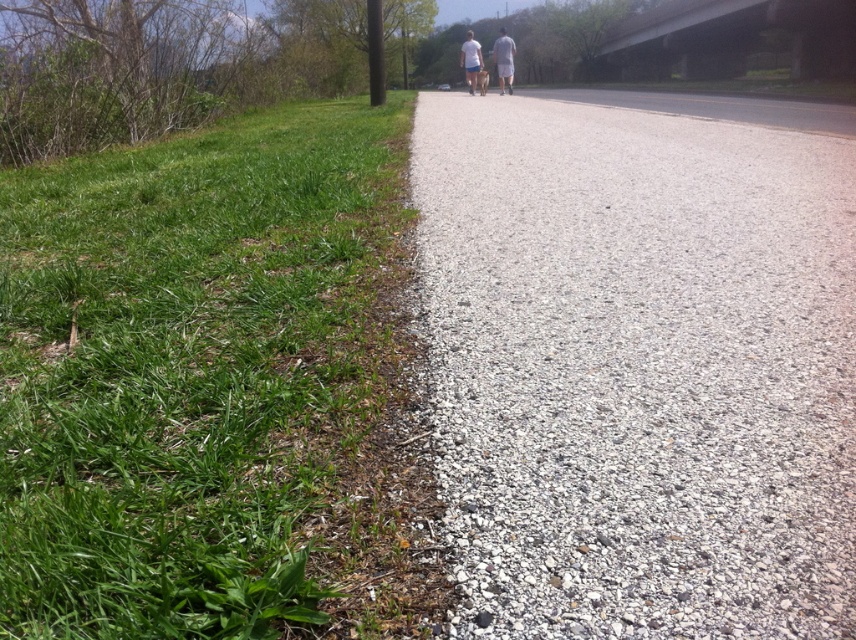
Between gray gravel at center and gray cotton shorts at center, which one is positioned higher?

Positioned higher is gray cotton shorts at center.

Can you confirm if gray gravel at center is bigger than gray cotton shorts at center?

Incorrect, gray gravel at center is not larger than gray cotton shorts at center.

Which is in front, point (580, 397) or point (500, 80)?

Positioned in front is point (580, 397).

At what (x,y) coordinates should I click in order to perform the action: click on gray gravel at center. Please return your answer as a coordinate pair (x, y). This screenshot has width=856, height=640. Looking at the image, I should click on (637, 369).

Is point (153, 275) positioned behind point (510, 48)?

No, (153, 275) is closer to viewer.

Which is in front, point (221, 342) or point (479, 64)?

Point (221, 342)

Image resolution: width=856 pixels, height=640 pixels. What do you see at coordinates (203, 380) in the screenshot?
I see `green grass at left` at bounding box center [203, 380].

You are a GUI agent. You are given a task and a screenshot of the screen. Output one action in this format:
    pyautogui.click(x=<x>, y=<y>)
    Task: Click on the green grass at left
    
    Given the screenshot: What is the action you would take?
    pyautogui.click(x=203, y=380)

Can you confirm if green grass at left is positioned to the left of white cotton shirt at center?

Correct, you'll find green grass at left to the left of white cotton shirt at center.

Does green grass at left have a greater height compared to white cotton shirt at center?

Incorrect, green grass at left's height is not larger of white cotton shirt at center's.

Which is in front, point (397, 346) or point (462, 65)?

Point (397, 346)

This screenshot has height=640, width=856. I want to click on green grass at left, so click(203, 380).